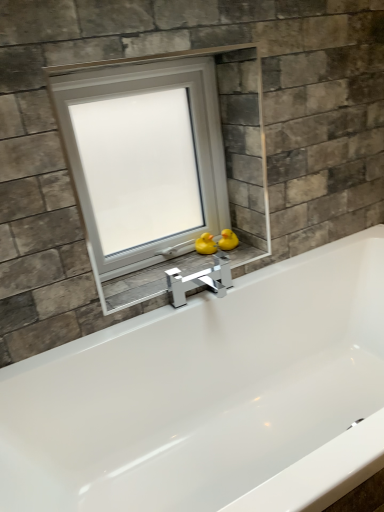
Question: Is matte gray stone at center further to the viewer compared to yellow rubber duck at center, the first duck viewed from the right?

Choices:
 (A) yes
 (B) no

Answer: (B)

Question: Is matte gray stone at center with yellow rubber duck at center, the first duck viewed from the right?

Choices:
 (A) no
 (B) yes

Answer: (A)

Question: From a real-world perspective, is matte gray stone at center beneath yellow rubber duck at center, acting as the 2th duck starting from the left?

Choices:
 (A) no
 (B) yes

Answer: (B)

Question: Considering the relative sizes of matte gray stone at center and yellow rubber duck at center, acting as the 2th duck starting from the left, in the image provided, is matte gray stone at center smaller than yellow rubber duck at center, acting as the 2th duck starting from the left,?

Choices:
 (A) yes
 (B) no

Answer: (B)

Question: Can you confirm if matte gray stone at center is wider than yellow rubber duck at center, acting as the 2th duck starting from the left?

Choices:
 (A) yes
 (B) no

Answer: (A)

Question: Based on their positions, is yellow rubber duck at center, which is the 2th duck from right to left, located to the left or right of matte gray stone at center?

Choices:
 (A) left
 (B) right

Answer: (B)

Question: Based on their sizes in the image, would you say yellow rubber duck at center, which is the 2th duck from right to left, is bigger or smaller than matte gray stone at center?

Choices:
 (A) big
 (B) small

Answer: (B)

Question: From a real-world perspective, relative to matte gray stone at center, is yellow rubber duck at center, which is the 2th duck from right to left, vertically above or below?

Choices:
 (A) above
 (B) below

Answer: (A)

Question: From the image's perspective, relative to matte gray stone at center, is yellow rubber duck at center, acting as the 1th duck starting from the left, above or below?

Choices:
 (A) above
 (B) below

Answer: (A)

Question: Considering the positions of point [198, 238] and point [188, 67], is point [198, 238] closer or farther from the camera than point [188, 67]?

Choices:
 (A) farther
 (B) closer

Answer: (A)

Question: Would you say yellow rubber duck at center, acting as the 1th duck starting from the left, is inside or outside white plastic window at center?

Choices:
 (A) inside
 (B) outside

Answer: (A)

Question: In terms of height, does yellow rubber duck at center, acting as the 1th duck starting from the left, look taller or shorter compared to white plastic window at center?

Choices:
 (A) tall
 (B) short

Answer: (B)

Question: In terms of size, does yellow rubber duck at center, acting as the 1th duck starting from the left, appear bigger or smaller than white plastic window at center?

Choices:
 (A) big
 (B) small

Answer: (B)

Question: From a real-world perspective, is yellow rubber duck at center, acting as the 2th duck starting from the left, physically located above or below yellow rubber duck at center, acting as the 1th duck starting from the left?

Choices:
 (A) below
 (B) above

Answer: (B)

Question: Relative to yellow rubber duck at center, which is the 2th duck from right to left, is yellow rubber duck at center, acting as the 2th duck starting from the left, in front or behind?

Choices:
 (A) behind
 (B) front

Answer: (A)